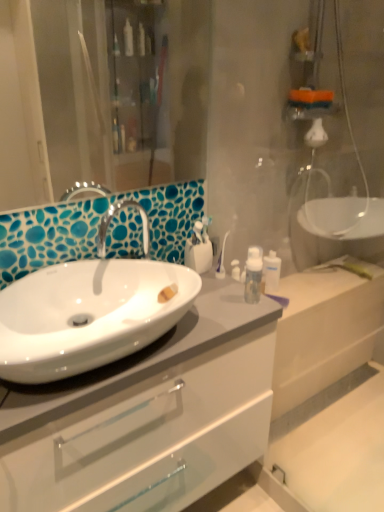
The image size is (384, 512). I want to click on free point in front of white glossy toothbrush holder at center, acting as the 2th toiletry starting from the back, so click(215, 296).